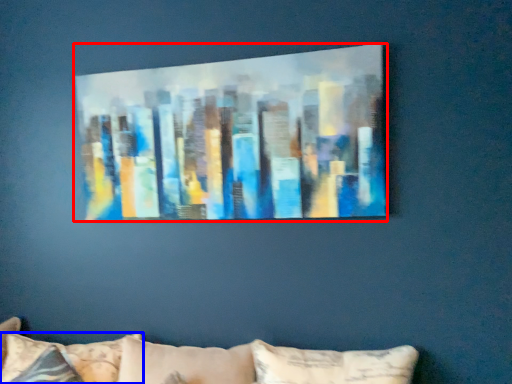
Question: Which object is closer to the camera taking this photo, picture frame (highlighted by a red box) or pillow (highlighted by a blue box)?

Choices:
 (A) picture frame
 (B) pillow

Answer: (A)